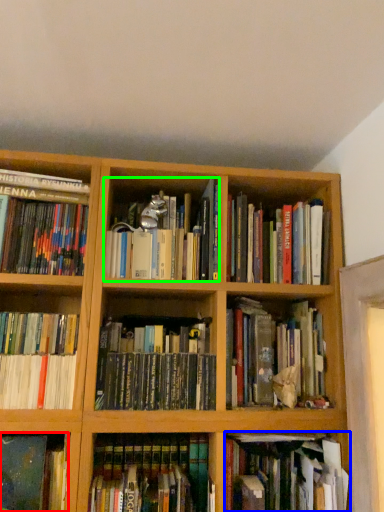
Question: Estimate the real-world distances between objects in this image. Which object is farther from book (highlighted by a red box), book (highlighted by a blue box) or book (highlighted by a green box)?

Choices:
 (A) book
 (B) book

Answer: (B)